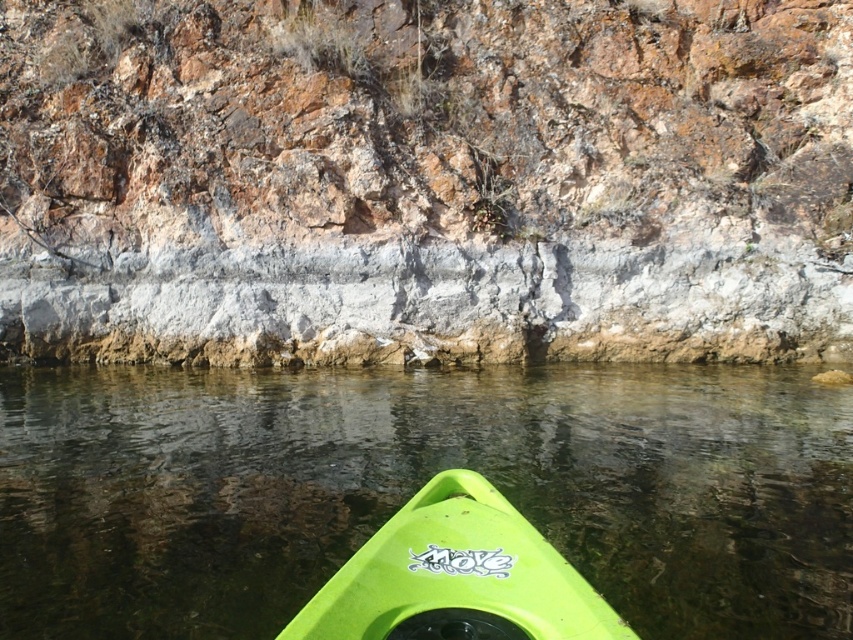
Measure the distance between green plastic kayak at lower center and camera.

green plastic kayak at lower center and camera are 5.17 meters apart from each other.

Who is more distant from viewer, [62,602] or [344,605]?

Positioned behind is point [62,602].

Who is more distant from viewer, (776,465) or (387,524)?

Point (776,465)

What are the coordinates of `green plastic kayak at lower center` in the screenshot? It's located at click(x=419, y=486).

Is rusty rock cliff at center taller than green matte kayak at lower center?

Yes, rusty rock cliff at center is taller than green matte kayak at lower center.

Does rusty rock cliff at center appear over green matte kayak at lower center?

Indeed, rusty rock cliff at center is positioned over green matte kayak at lower center.

This screenshot has width=853, height=640. What do you see at coordinates (425, 180) in the screenshot? I see `rusty rock cliff at center` at bounding box center [425, 180].

This screenshot has height=640, width=853. What are the coordinates of `rusty rock cliff at center` in the screenshot? It's located at (425, 180).

Measure the distance between point [445,192] and camera.

A distance of 20.88 meters exists between point [445,192] and camera.

Is point (746, 38) closer to camera compared to point (746, 426)?

That is False.

The image size is (853, 640). Find the location of `rusty rock cliff at center`. rusty rock cliff at center is located at coordinates (425, 180).